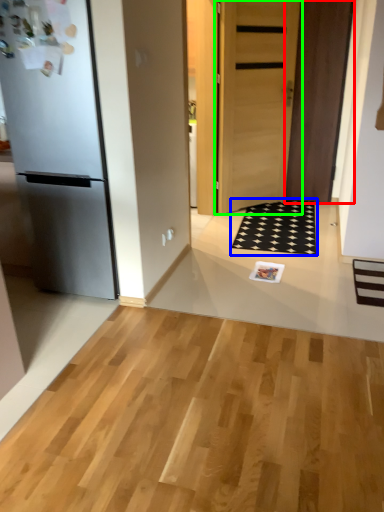
Question: Which object is the farthest from door (highlighted by a red box)? Choose among these: doormat (highlighted by a blue box) or door (highlighted by a green box).

Choices:
 (A) doormat
 (B) door

Answer: (A)